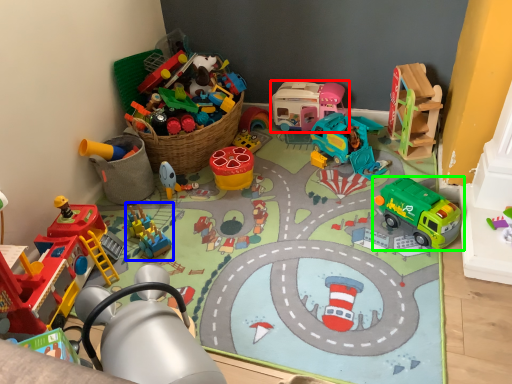
Question: Considering the real-world distances, which object is farthest from toy (highlighted by a red box)? toy (highlighted by a blue box) or toy (highlighted by a green box)?

Choices:
 (A) toy
 (B) toy

Answer: (A)